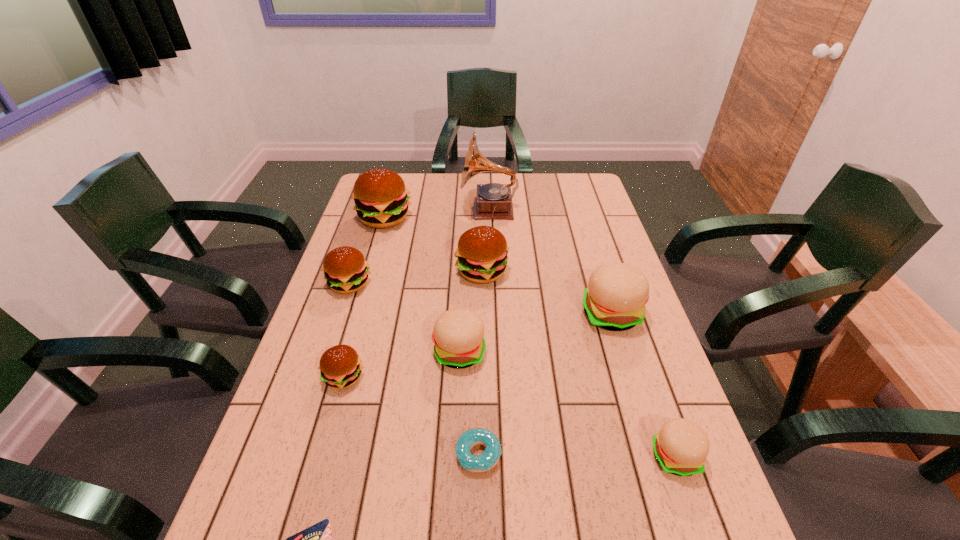
Locate an element on the screen. free space between the rightmost brown hamburger and the second smallest brown hamburger is located at coordinates (416, 278).

Identify the location of free spot between the biggest beige hamburger and the tallest object. (550, 262).

This screenshot has width=960, height=540. Find the location of `vacant space in between the doughnut and the smallest beige hamburger`. vacant space in between the doughnut and the smallest beige hamburger is located at coordinates (577, 455).

At what (x,y) coordinates should I click in order to perform the action: click on vacant area between the smallest beige hamburger and the biggest beige hamburger. Please return your answer as a coordinate pair (x, y). This screenshot has width=960, height=540. Looking at the image, I should click on (643, 385).

Select which object is the fifth closest to the second shortest object. Please provide its 2D coordinates. Your answer should be formatted as a tuple, i.e. [(x, y)], where the tuple contains the x and y coordinates of a point satisfying the conditions above.

[(615, 298)]

Locate which object ranks second in proximity to the leftmost beige hamburger. Please provide its 2D coordinates. Your answer should be formatted as a tuple, i.e. [(x, y)], where the tuple contains the x and y coordinates of a point satisfying the conditions above.

[(489, 458)]

Find the location of a particular element. The height and width of the screenshot is (540, 960). hamburger that is the second closest to the third biggest brown hamburger is located at coordinates (340, 366).

Identify the location of hamburger that is the closest to the third biggest brown hamburger. This screenshot has width=960, height=540. (381, 201).

Select which brown hamburger appears as the second closest to the nearest hamburger. Please provide its 2D coordinates. Your answer should be formatted as a tuple, i.e. [(x, y)], where the tuple contains the x and y coordinates of a point satisfying the conditions above.

[(340, 366)]

Identify the location of brown hamburger that is the closest to the nearest brown hamburger. (346, 271).